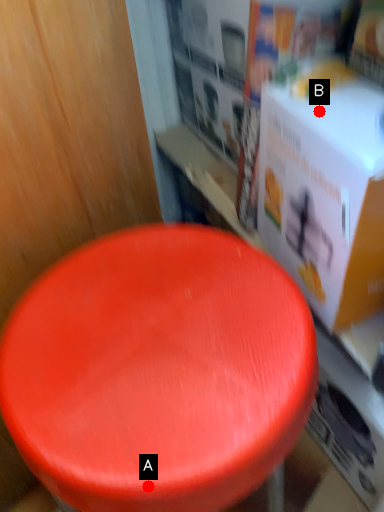
Question: Two points are circled on the image, labeled by A and B beside each circle. Which point is farther to the camera?

Choices:
 (A) A is further
 (B) B is further

Answer: (B)